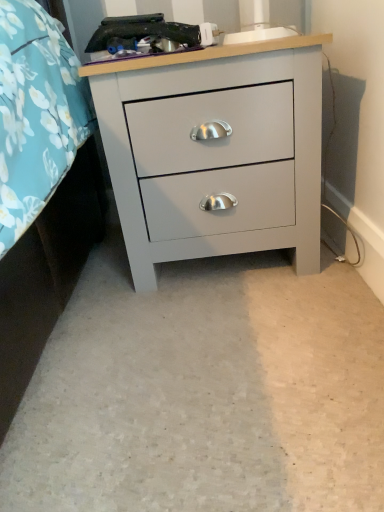
The height and width of the screenshot is (512, 384). What are the coordinates of `vacant area that is in front of matte gray cabinet at center` in the screenshot? It's located at (223, 342).